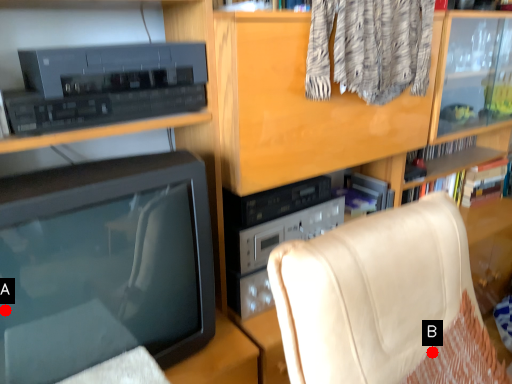
Question: Two points are circled on the image, labeled by A and B beside each circle. Which of the following is the closest to the observer?

Choices:
 (A) A is closer
 (B) B is closer

Answer: (A)